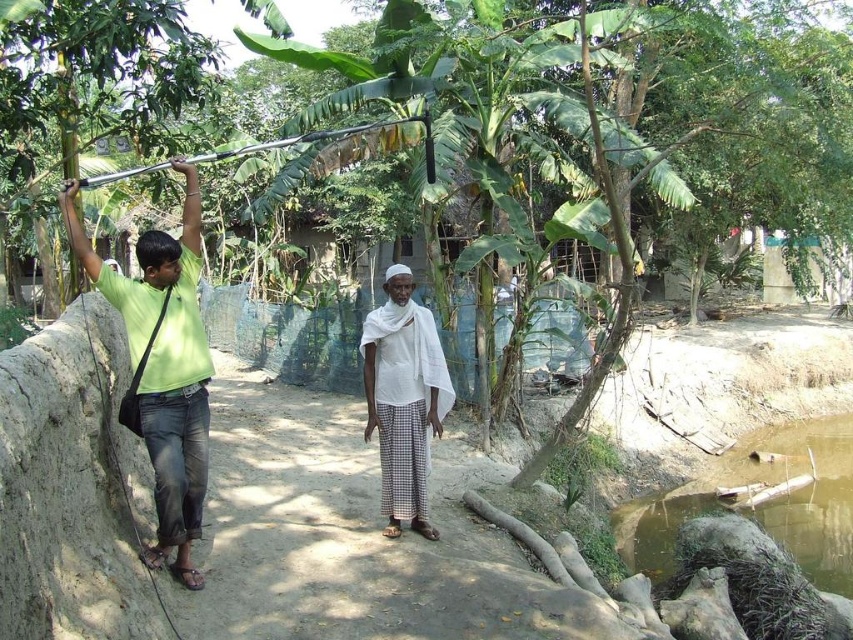
Question: Among these objects, which one is nearest to the camera?

Choices:
 (A) green matte shirt at left
 (B) white cotton cloth at center
 (C) brown murky water at lower right

Answer: (A)

Question: Which point is farther to the camera?

Choices:
 (A) brown murky water at lower right
 (B) green matte shirt at left

Answer: (A)

Question: In this image, where is brown murky water at lower right located relative to white cotton cloth at center?

Choices:
 (A) above
 (B) below

Answer: (B)

Question: Is brown murky water at lower right thinner than white cotton cloth at center?

Choices:
 (A) yes
 (B) no

Answer: (A)

Question: Which object appears farthest from the camera in this image?

Choices:
 (A) white cotton cloth at center
 (B) green matte shirt at left

Answer: (A)

Question: Is green matte shirt at left above white cotton cloth at center?

Choices:
 (A) yes
 (B) no

Answer: (A)